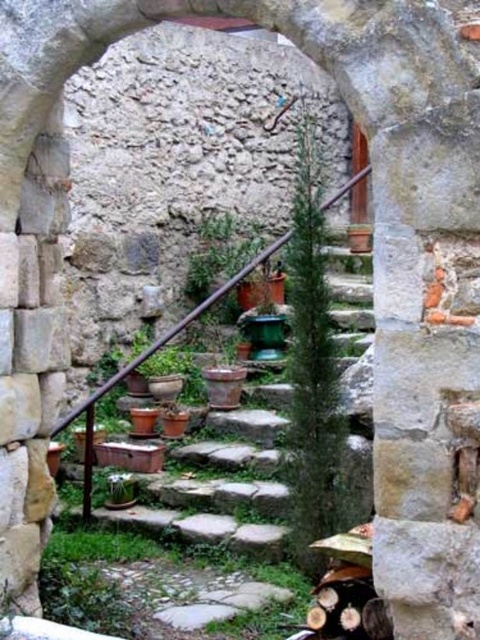
Which of these two, green textured plant at center or green matte plant at center, stands taller?

Standing taller between the two is green textured plant at center.

You are a GUI agent. You are given a task and a screenshot of the screen. Output one action in this format:
    pyautogui.click(x=<x>, y=<y>)
    Task: Click on the green textured plant at center
    Image resolution: width=480 pixels, height=640 pixels.
    Given the screenshot: What is the action you would take?
    pyautogui.click(x=311, y=364)